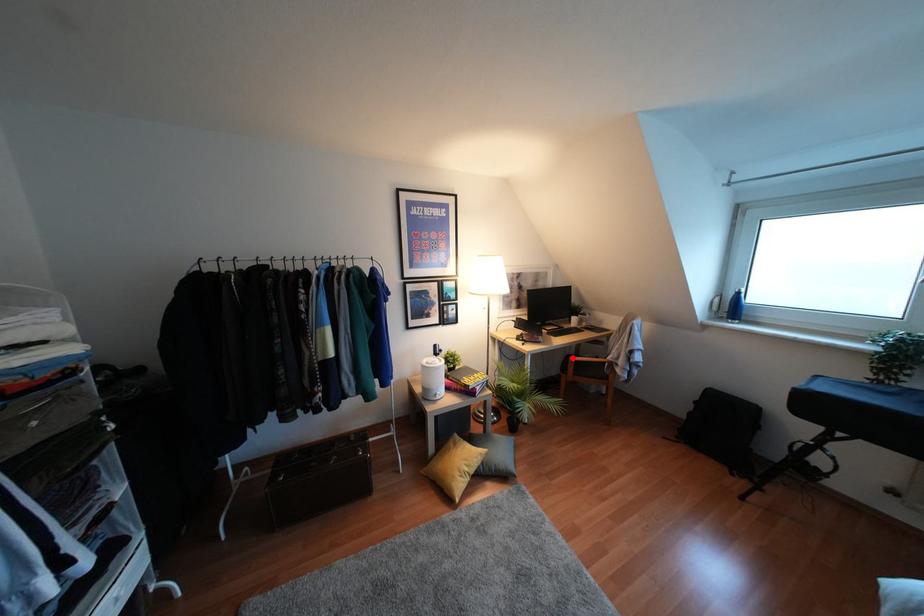
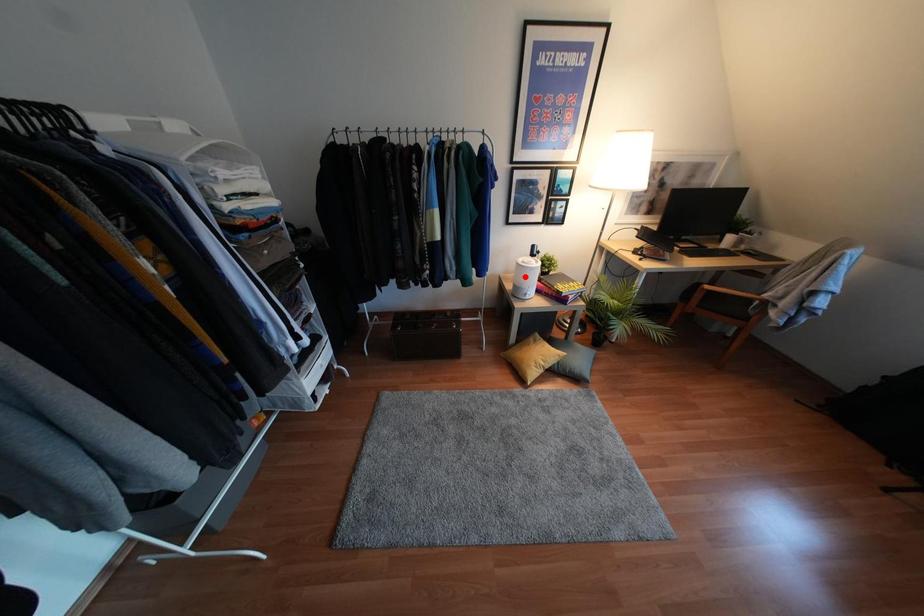
I am providing you with two images of the same scene from different viewpoints. A red point is marked on the first image and another point is marked on the second image. Does the point marked in image1 correspond to the same location as the one in image2?

No